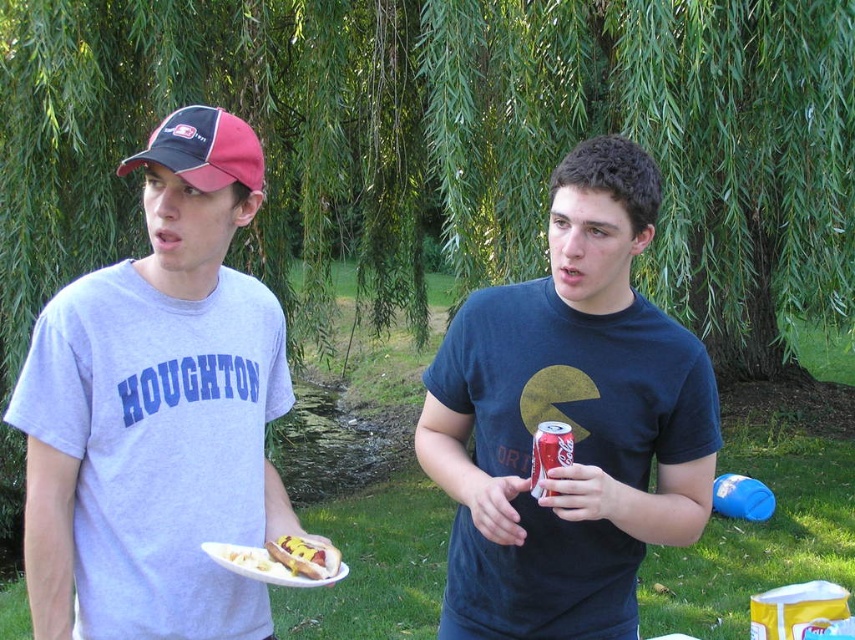
Which is behind, point (327, 550) or point (532, 449)?

The point (327, 550) is behind.

Between yellow mustard-covered hot dog at lower left and coke can at center, which one appears on the right side from the viewer's perspective?

From the viewer's perspective, coke can at center appears more on the right side.

Identify the location of yellow mustard-covered hot dog at lower left. (305, 556).

Is shiny red can at center bigger than black and pink baseball cap at left?

Indeed, shiny red can at center has a larger size compared to black and pink baseball cap at left.

Which is behind, point (516, 520) or point (205, 113)?

The point (205, 113) is more distant.

Is point (622, 314) more distant than point (207, 148)?

Yes, it is.

At what (x,y) coordinates should I click in order to perform the action: click on shiny red can at center. Please return your answer as a coordinate pair (x, y). Image resolution: width=855 pixels, height=640 pixels. Looking at the image, I should click on (569, 420).

Between gray cotton t-shirt at left and black and pink baseball cap at left, which one has less height?

black and pink baseball cap at left is shorter.

Between gray cotton t-shirt at left and black and pink baseball cap at left, which one appears on the left side from the viewer's perspective?

From the viewer's perspective, gray cotton t-shirt at left appears more on the left side.

Where is `gray cotton t-shirt at left`? The image size is (855, 640). gray cotton t-shirt at left is located at coordinates (158, 412).

The width and height of the screenshot is (855, 640). In order to click on gray cotton t-shirt at left in this screenshot , I will do `click(158, 412)`.